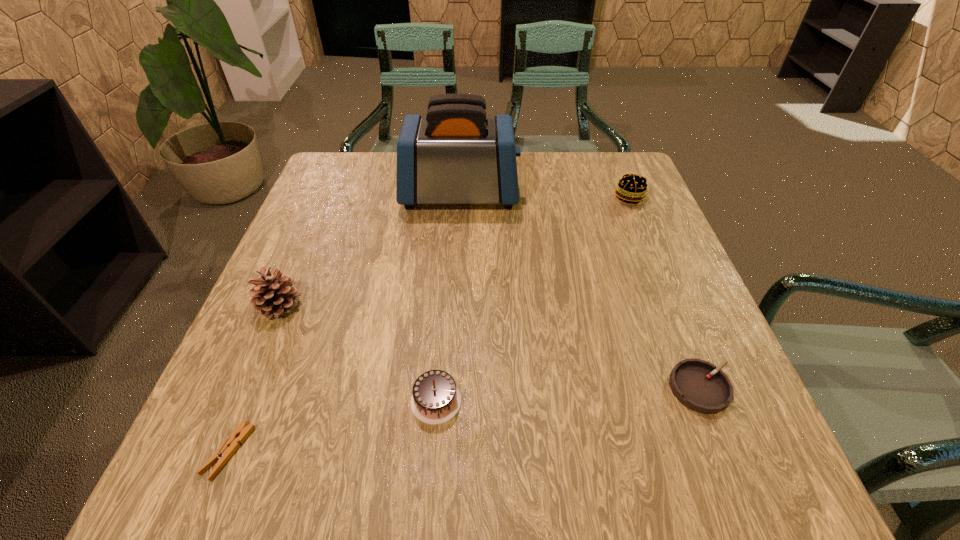
The image size is (960, 540). I want to click on toaster, so click(x=456, y=154).

What are the coordinates of `the third farthest object` in the screenshot? It's located at (273, 295).

Identify the location of pinecone. The image size is (960, 540). (273, 295).

The image size is (960, 540). In order to click on patty in this screenshot , I will do `click(631, 188)`.

The image size is (960, 540). In order to click on chocolate cake in this screenshot , I will do `click(435, 399)`.

Find the location of `the second shortest object`. the second shortest object is located at coordinates (699, 385).

The height and width of the screenshot is (540, 960). Find the location of `clothespin`. clothespin is located at coordinates [x=231, y=444].

You are a GUI agent. You are given a task and a screenshot of the screen. Output one action in this format:
    pyautogui.click(x=<x>, y=<y>)
    Task: Click on the free location located on the front-facing side of the toaster
    The image size is (960, 540).
    Given the screenshot: What is the action you would take?
    pyautogui.click(x=594, y=194)

Identify the location of vacant space located on the front of the fifth shortest object. (238, 403).

Where is `vacant space located on the front of the patty`? Image resolution: width=960 pixels, height=540 pixels. vacant space located on the front of the patty is located at coordinates (678, 318).